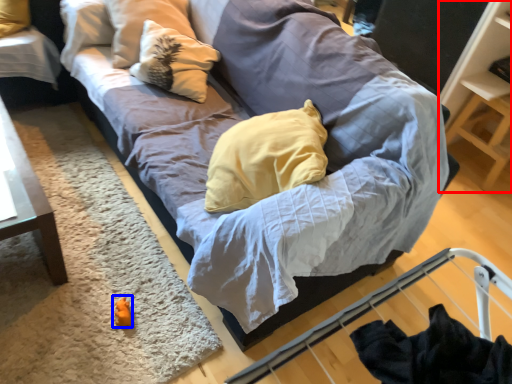
Question: Which of the following is the farthest to the observer, shelf (highlighted by a red box) or toy (highlighted by a blue box)?

Choices:
 (A) shelf
 (B) toy

Answer: (A)